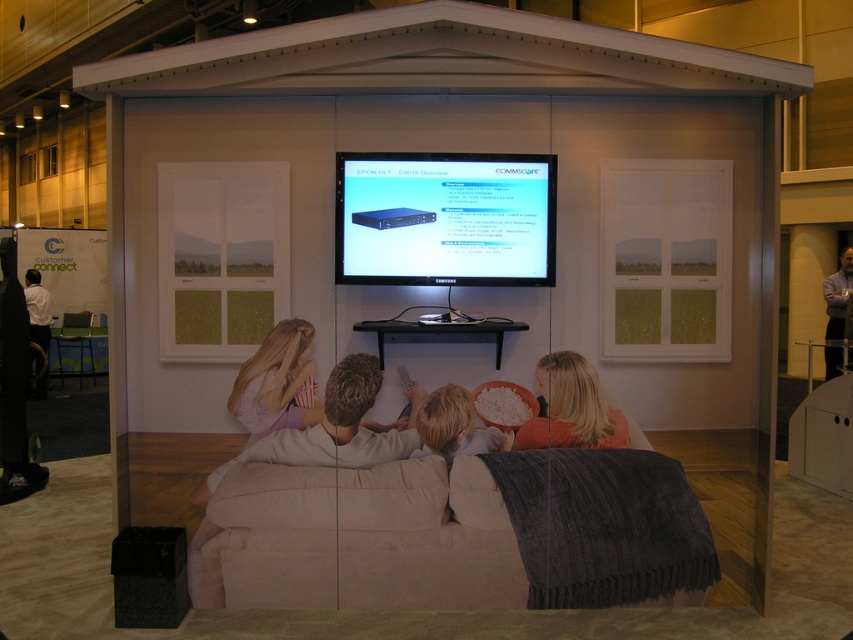
Question: Does gray fabric jacket at upper right appear over white shirt at left?

Choices:
 (A) yes
 (B) no

Answer: (A)

Question: Which point is farther to the camera?

Choices:
 (A) light brown fabric couch at center
 (B) beige fabric couch at center
 (C) white shirt at left
 (D) gray fabric jacket at upper right

Answer: (C)

Question: Which object appears farthest from the camera in this image?

Choices:
 (A) matte black monitor at center
 (B) orange fleece blanket at lower center
 (C) gray fabric jacket at upper right
 (D) beige fabric couch at center

Answer: (C)

Question: Does orange fleece blanket at lower center have a lesser width compared to white shirt at left?

Choices:
 (A) yes
 (B) no

Answer: (A)

Question: Estimate the real-world distances between objects in this image. Which object is closer to the beige fabric couch at center?

Choices:
 (A) white shirt at left
 (B) orange fleece blanket at lower center
 (C) gray fabric jacket at upper right
 (D) light brown fabric couch at center

Answer: (D)

Question: Is beige fabric couch at center further to the viewer compared to gray fabric jacket at upper right?

Choices:
 (A) yes
 (B) no

Answer: (B)